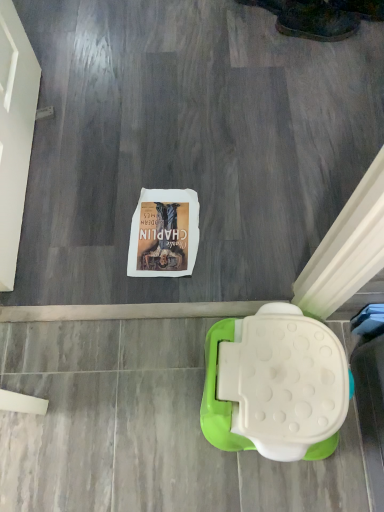
This screenshot has width=384, height=512. Find the location of `vacant area that lies to the right of leather boot at upper right`. vacant area that lies to the right of leather boot at upper right is located at coordinates (366, 41).